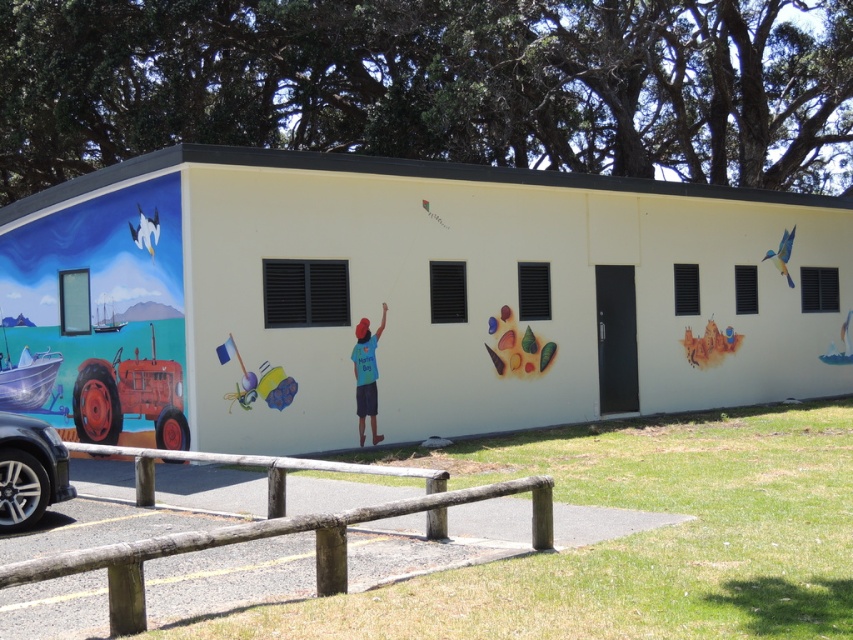
Measure the distance between matte yellow building at center and camera.

matte yellow building at center is 11.09 meters away from camera.

Can you confirm if matte yellow building at center is thinner than shiny silver car at lower left?

No.

Who is more forward, (819, 208) or (53, 448)?

Point (53, 448) is more forward.

Image resolution: width=853 pixels, height=640 pixels. What are the coordinates of `matte yellow building at center` in the screenshot? It's located at (407, 296).

Is the position of matte yellow building at center less distant than that of matte yellow castle at center right?

Yes, matte yellow building at center is in front of matte yellow castle at center right.

Is matte yellow building at center thinner than matte yellow castle at center right?

No, matte yellow building at center is not thinner than matte yellow castle at center right.

Describe the element at coordinates (407, 296) in the screenshot. I see `matte yellow building at center` at that location.

Locate an element on the screen. Image resolution: width=853 pixels, height=640 pixels. matte yellow building at center is located at coordinates (407, 296).

Which is in front, point (65, 456) or point (709, 352)?

Point (65, 456) is in front.

Which is behind, point (22, 452) or point (704, 356)?

Point (704, 356)

Between point (7, 452) and point (698, 355), which one is positioned in front?

Point (7, 452)

Where is `shiny silver car at lower left`? This screenshot has height=640, width=853. shiny silver car at lower left is located at coordinates (28, 470).